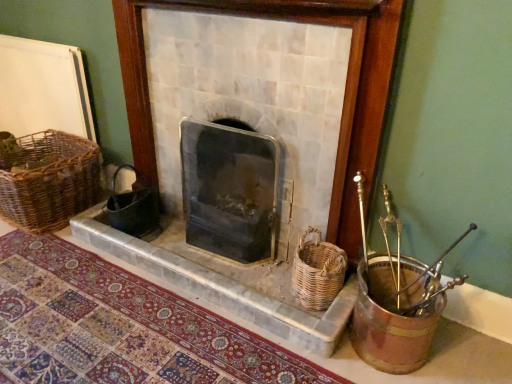
Find the location of a particular element. The height and width of the screenshot is (384, 512). free space to the left of woven brown basket at lower right, acting as the 1th basket starting from the front is located at coordinates (266, 282).